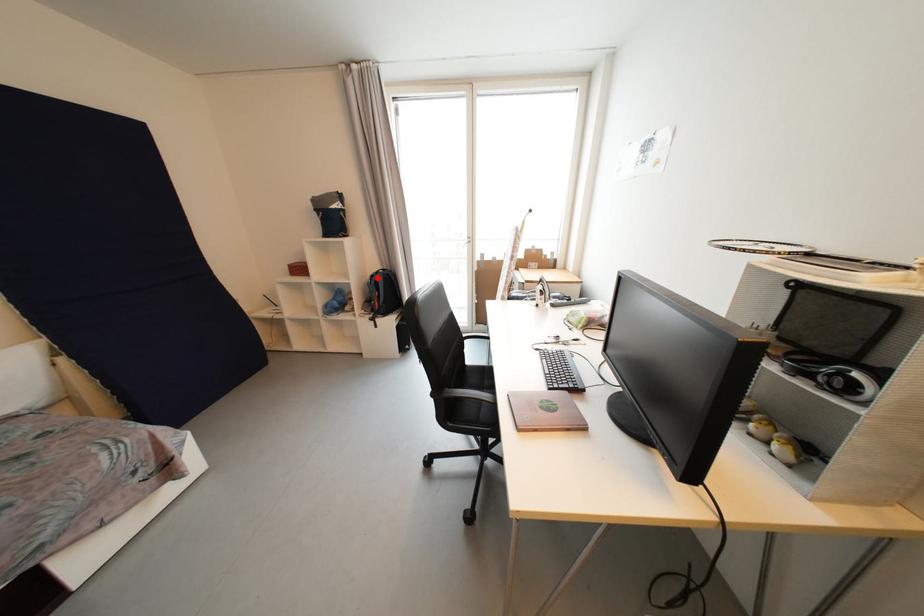
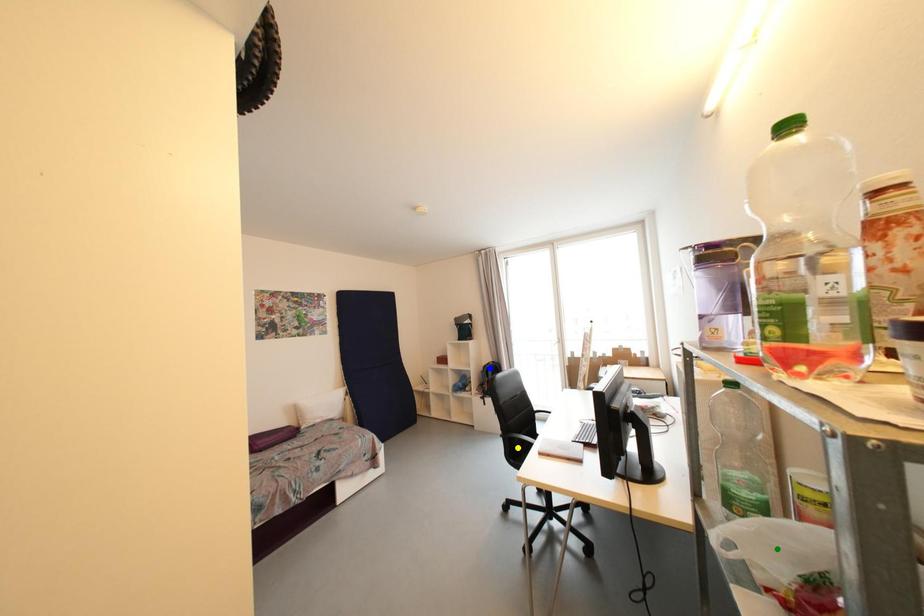
Question: I am providing you with two images of the same scene from different viewpoints. A red point is marked on the first image. You are given multiple points on the second image. Which point in image 2 is actually the same real-world point as the red point in image 1?

Choices:
 (A) yellow point
 (B) blue point
 (C) green point

Answer: (B)